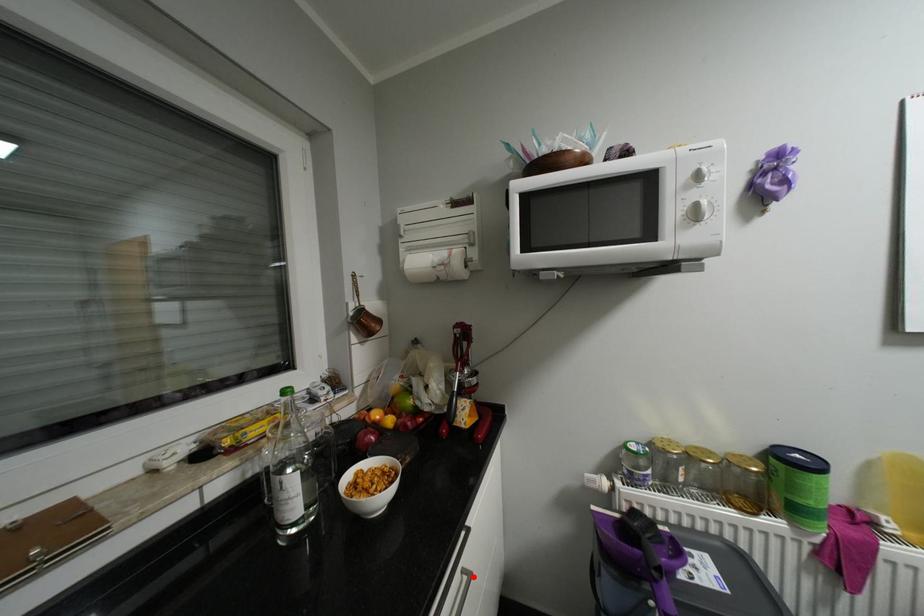
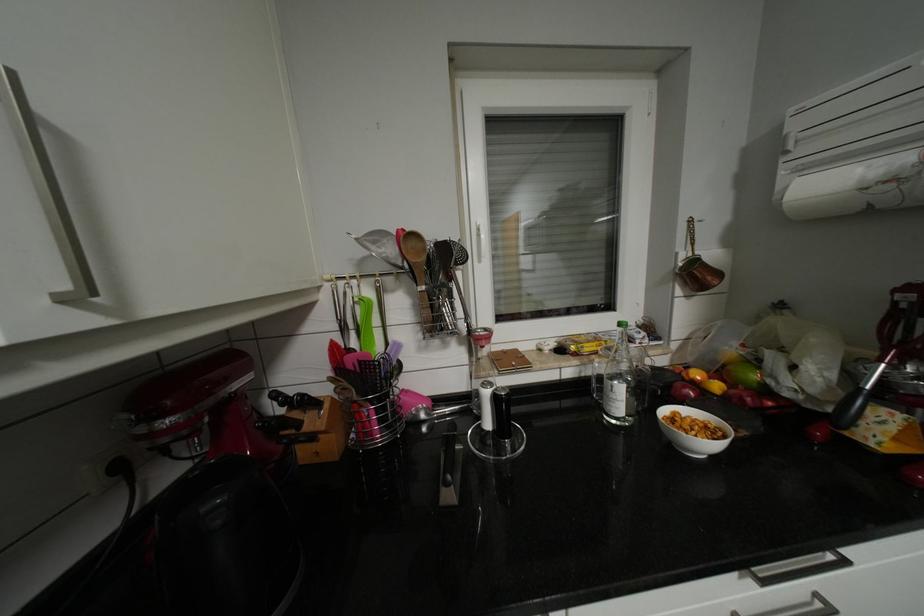
Where in the second image is the point corresponding to the highlighted location from the first image?

(827, 604)